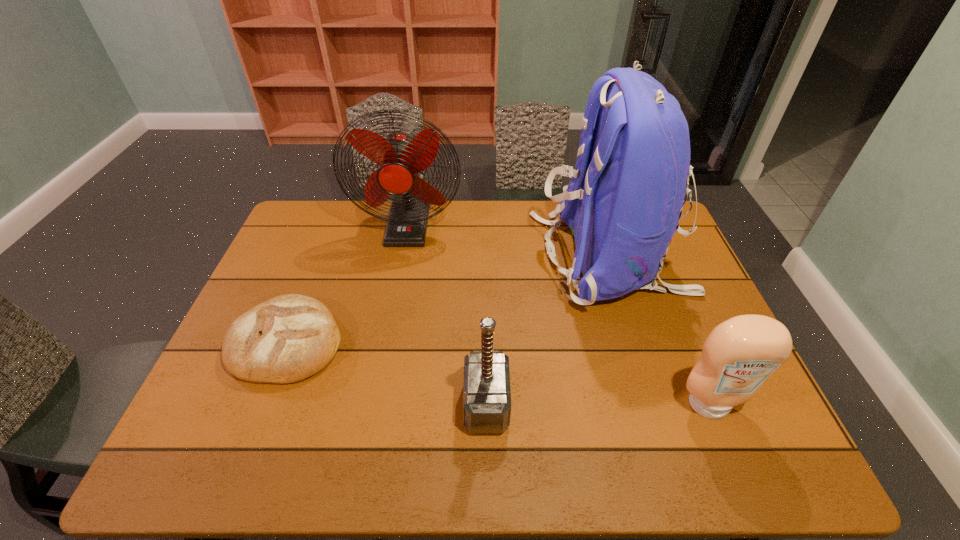
Locate an element on the screen. This screenshot has height=540, width=960. vacant space that is in between the fan and the tallest object is located at coordinates (509, 241).

This screenshot has height=540, width=960. Identify the location of empty space between the backpack and the second tallest object. [x=509, y=241].

Where is `free area in between the condiment and the tallest object`? This screenshot has width=960, height=540. free area in between the condiment and the tallest object is located at coordinates 660,332.

This screenshot has height=540, width=960. Identify the location of object that can be found as the fourth closest to the condiment. (286, 339).

This screenshot has height=540, width=960. What are the coordinates of `object that ranks as the closest to the shortest object` in the screenshot? It's located at (401, 156).

At what (x,y) coordinates should I click in order to perform the action: click on vacant space that satisfies the following two spatial constraints: 1. on the back of the backpack; 2. on the front side of the hammer. Please return your answer as a coordinate pair (x, y). This screenshot has width=960, height=540. Looking at the image, I should click on (656, 404).

Where is `vacant area that satisfies the following two spatial constraints: 1. on the front side of the hammer; 2. on the right side of the bread`? vacant area that satisfies the following two spatial constraints: 1. on the front side of the hammer; 2. on the right side of the bread is located at coordinates (262, 404).

Where is `vacant space that satisfies the following two spatial constraints: 1. on the front-facing side of the third object from right to left; 2. on the right side of the fourth shortest object`? vacant space that satisfies the following two spatial constraints: 1. on the front-facing side of the third object from right to left; 2. on the right side of the fourth shortest object is located at coordinates (373, 404).

Find the location of a particular element. Image resolution: width=960 pixels, height=540 pixels. free spot that satisfies the following two spatial constraints: 1. on the front-facing side of the fan; 2. on the left side of the hammer is located at coordinates (373, 404).